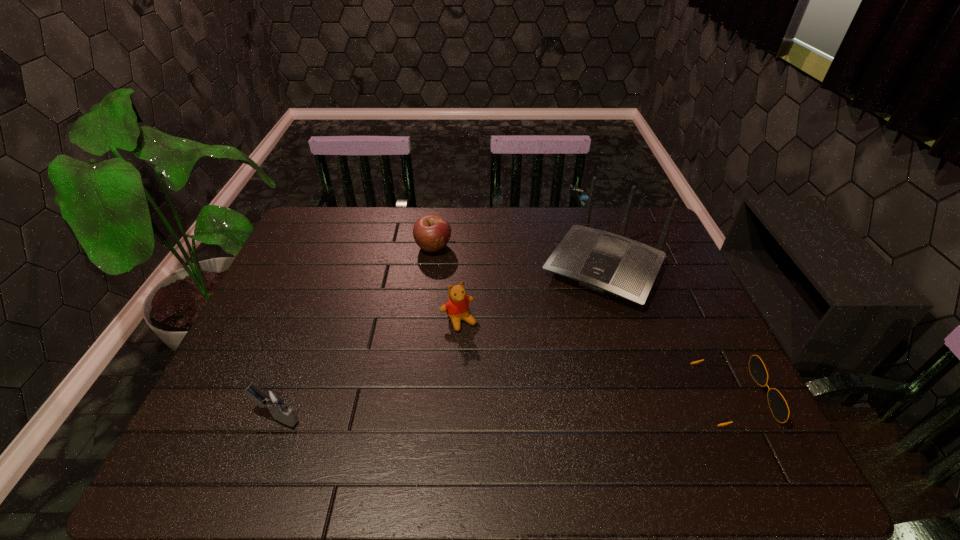
This screenshot has width=960, height=540. In order to click on the leftmost object in this screenshot , I will do `click(271, 400)`.

I want to click on the shortest object, so click(778, 405).

Where is `the second shortest object`? This screenshot has height=540, width=960. the second shortest object is located at coordinates (431, 232).

This screenshot has height=540, width=960. In order to click on router in this screenshot , I will do `click(601, 261)`.

You are a GUI agent. You are given a task and a screenshot of the screen. Output one action in this format:
    pyautogui.click(x=<x>, y=<y>)
    Task: Click on the teddy bear
    
    Given the screenshot: What is the action you would take?
    pyautogui.click(x=457, y=307)

Where is `free region located on the left of the leftmost object`? free region located on the left of the leftmost object is located at coordinates (223, 417).

Locate an element on the screen. The width and height of the screenshot is (960, 540). vacant space positioned 0.350m on the side of the apple with the unique marking is located at coordinates (446, 345).

This screenshot has height=540, width=960. I want to click on free region located 0.140m on the side of the apple with the unique marking, so click(439, 289).

At what (x,y) coordinates should I click in order to perform the action: click on vacant position located 0.250m on the side of the apple with the unique marking. Please return your answer as a coordinate pair (x, y). Looking at the image, I should click on (443, 316).

Where is `vacant area situated on the front-facing side of the router`? vacant area situated on the front-facing side of the router is located at coordinates (532, 388).